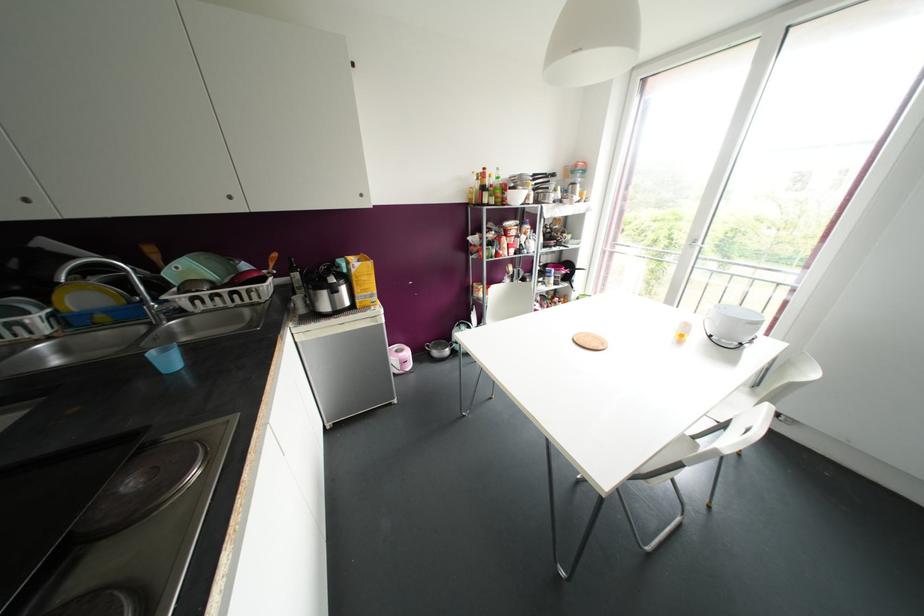
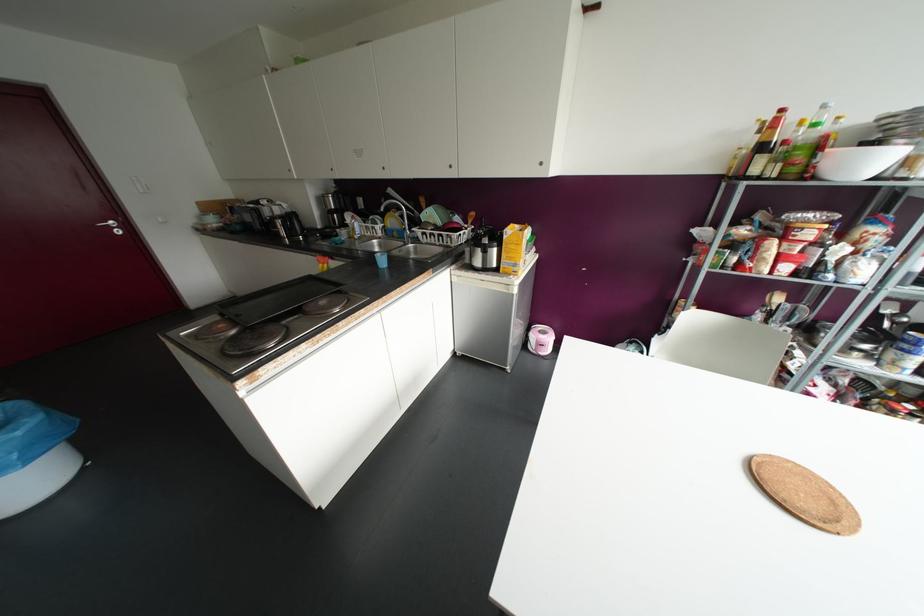
In the second image, find the point that corresponds to (x=483, y=168) in the first image.

(781, 110)